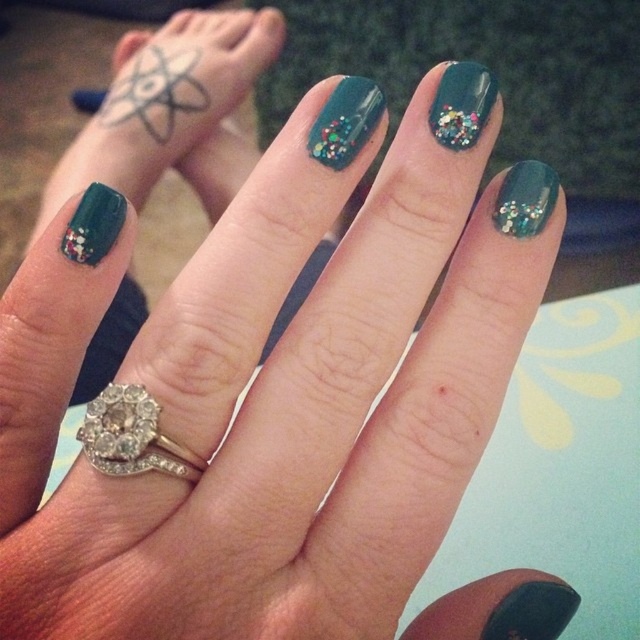
You are a nail technician observing the hand with teal glitter nail polish at center and teal glitter nail polish at upper right. Which one of these two teal glitter nail polish is bigger?

The teal glitter nail polish at center is larger than the teal glitter nail polish at upper right.

You are a nail technician trying to apply a new coat of teal glitter nail polish at upper right onto the glittery teal nail at upper right. Based on the provided image, will the polish bottle be wide enough to cover the nail without spilling?

The teal glitter nail polish at upper right has a larger width than the glittery teal nail at upper right, so the polish bottle should be wide enough to cover the nail without spilling.